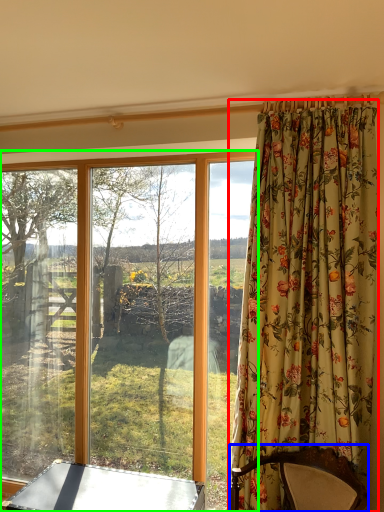
Question: Which object is positioned farthest from curtain (highlighted by a red box)? Select from furniture (highlighted by a blue box) and window (highlighted by a green box).

Choices:
 (A) furniture
 (B) window

Answer: (B)